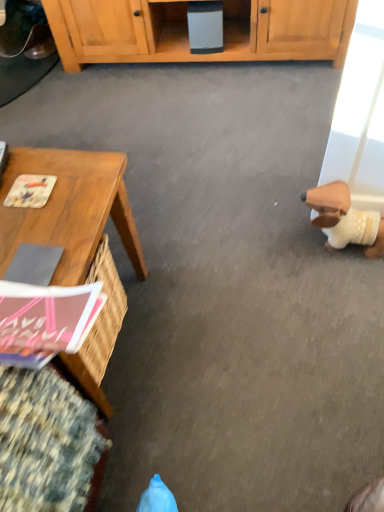
This screenshot has width=384, height=512. In order to click on free space in front of brown plush toy at right in this screenshot , I will do `click(347, 286)`.